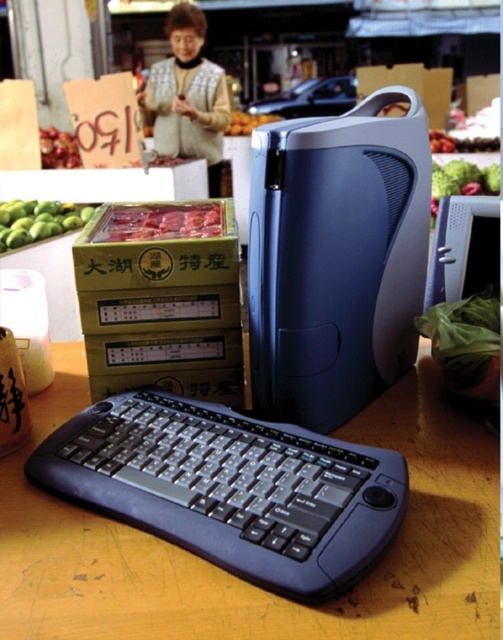
Which is below, black plastic keyboard at lower center or green leafy vegetable at right?

black plastic keyboard at lower center is below.

Is black plastic keyboard at lower center thinner than green leafy vegetable at right?

Yes.

I want to click on black plastic keyboard at lower center, so click(230, 488).

Does green plastic bag at lower right have a lesser width compared to green matte apples at left?

Yes.

Does green plastic bag at lower right appear over green matte apples at left?

No, green plastic bag at lower right is not above green matte apples at left.

Who is more distant from viewer, (439,356) or (56,205)?

Point (56,205)

Image resolution: width=503 pixels, height=640 pixels. Identify the location of green plastic bag at lower right. (465, 342).

In the scene shown: Does satin blue desktop at center have a lesser width compared to green leafy vegetable at right?

Yes, satin blue desktop at center is thinner than green leafy vegetable at right.

This screenshot has height=640, width=503. In order to click on satin blue desktop at center in this screenshot , I will do `click(336, 259)`.